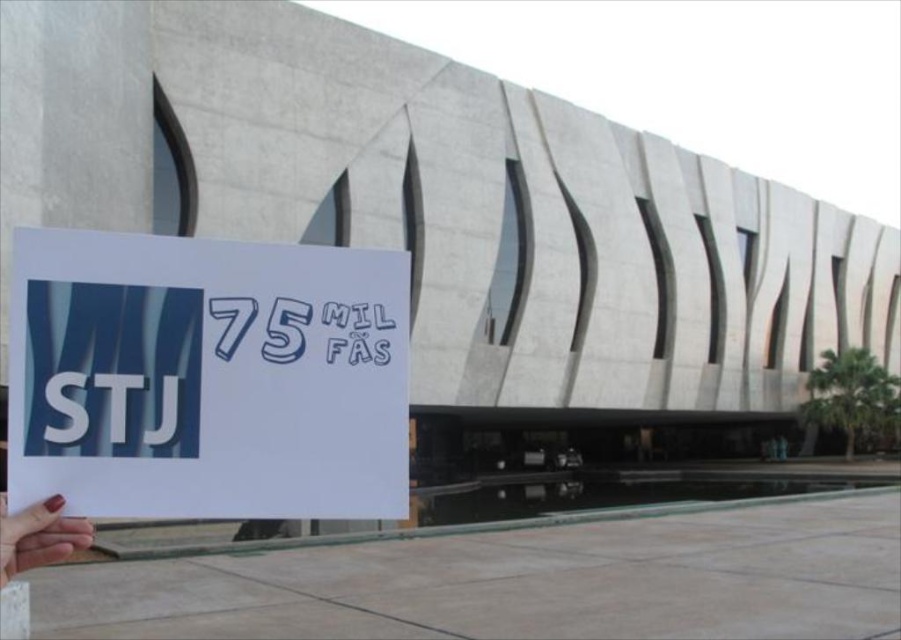
Is point (246, 260) positioned before point (53, 522)?

No.

Who is positioned more to the right, white paper at center or smooth skin hand at lower left?

Positioned to the right is white paper at center.

Where is `white paper at center`? white paper at center is located at coordinates (207, 378).